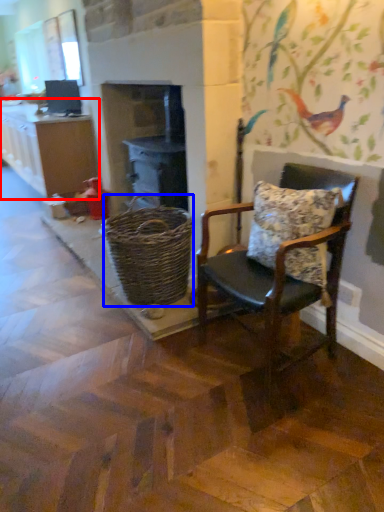
Question: Which object is further to the camera taking this photo, cabinetry (highlighted by a red box) or basket (highlighted by a blue box)?

Choices:
 (A) cabinetry
 (B) basket

Answer: (A)